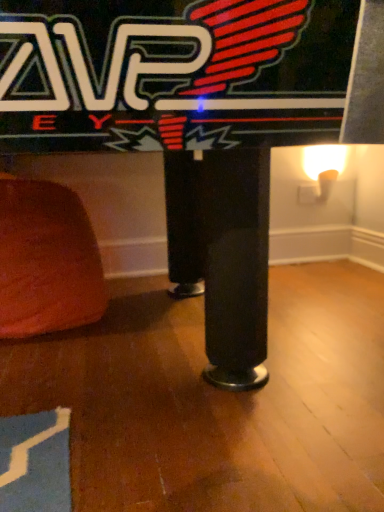
Find the location of a particular element. The width and height of the screenshot is (384, 512). free spot to the right of matte brown ottoman at lower left is located at coordinates (155, 315).